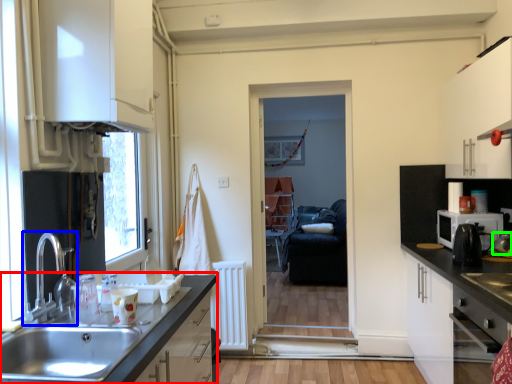
Question: Based on their relative distances, which object is farther from countertop (highlighted by a red box)? Choose from tap (highlighted by a blue box) and appliance (highlighted by a green box).

Choices:
 (A) tap
 (B) appliance

Answer: (B)